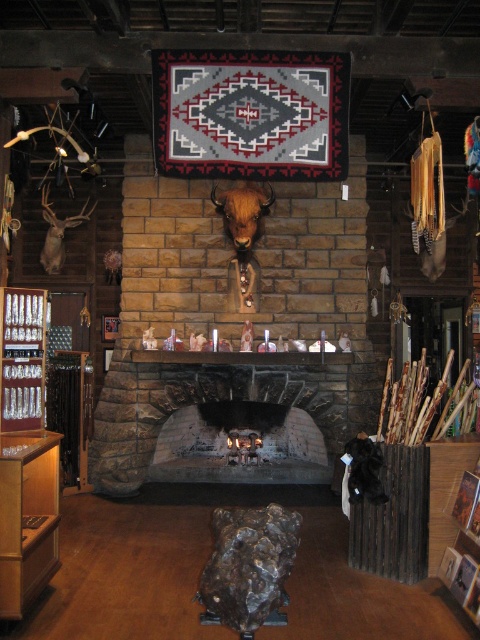
Is black stone fireplace at center positioned in front of matte brown deer head at left?

Yes, it is.

Can you confirm if black stone fireplace at center is positioned to the left of matte brown deer head at left?

No, black stone fireplace at center is not to the left of matte brown deer head at left.

What are the coordinates of `black stone fireplace at center` in the screenshot? It's located at (248, 417).

Locate an element on the screen. The height and width of the screenshot is (640, 480). black stone fireplace at center is located at coordinates (248, 417).